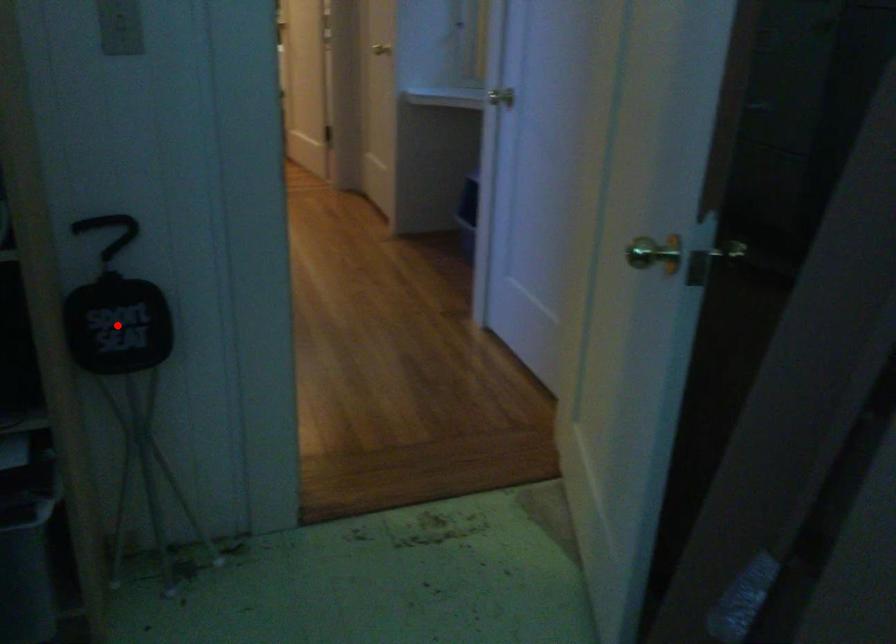
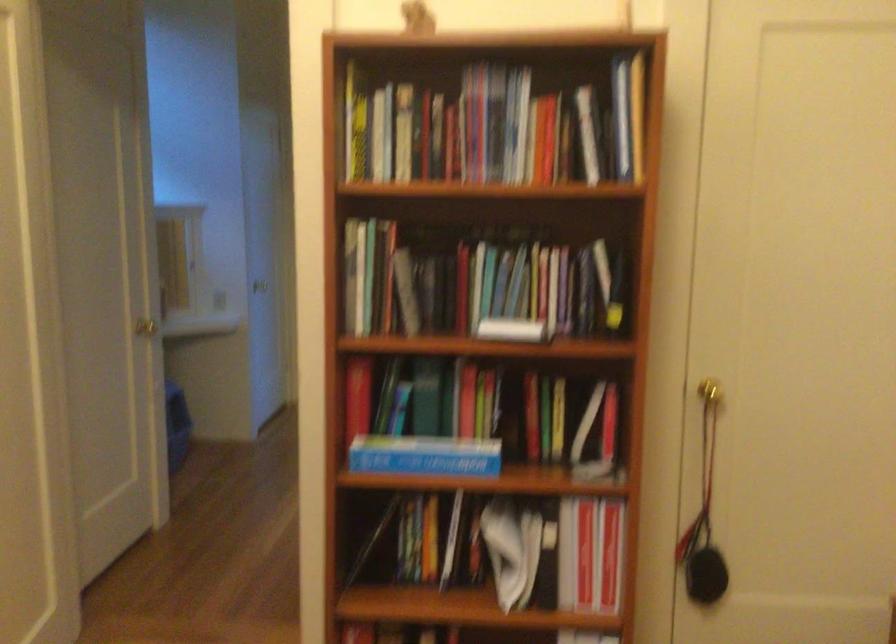
Question: I am providing you with two images of the same scene from different viewpoints. A red point is marked on the first image. At the location where the point appears in image 1, is it still visible in image 2?

Choices:
 (A) Yes
 (B) No

Answer: (B)